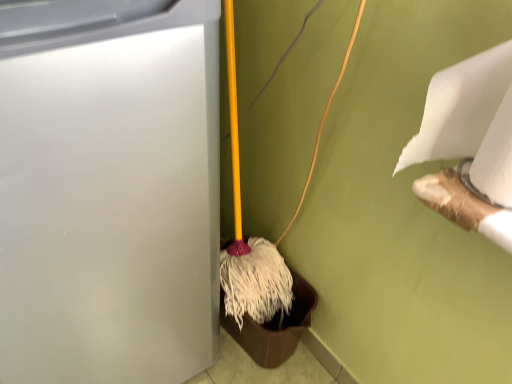
Question: Is white matte waste container at left a part of white matte toilet paper at upper right, which is the second toilet paper in left-to-right order?

Choices:
 (A) yes
 (B) no

Answer: (B)

Question: Is white matte toilet paper at upper right, which is the second toilet paper in left-to-right order, not within white matte waste container at left?

Choices:
 (A) yes
 (B) no

Answer: (A)

Question: Does white matte toilet paper at upper right, which is the 1th toilet paper in right-to-left order, appear on the left side of white matte waste container at left?

Choices:
 (A) yes
 (B) no

Answer: (B)

Question: Is white matte toilet paper at upper right, which is the 1th toilet paper in right-to-left order, oriented away from white matte waste container at left?

Choices:
 (A) yes
 (B) no

Answer: (B)

Question: Is white matte toilet paper at upper right, which is the 1th toilet paper in right-to-left order, shorter than white matte waste container at left?

Choices:
 (A) no
 (B) yes

Answer: (B)

Question: In terms of height, does white matte toilet paper at upper right, positioned as the 1th toilet paper in left-to-right order, look taller or shorter compared to white matte waste container at left?

Choices:
 (A) short
 (B) tall

Answer: (A)

Question: In the image, is white matte toilet paper at upper right, placed as the 2th toilet paper when sorted from right to left, on the left side or the right side of white matte waste container at left?

Choices:
 (A) left
 (B) right

Answer: (B)

Question: In terms of width, does white matte toilet paper at upper right, placed as the 2th toilet paper when sorted from right to left, look wider or thinner when compared to white matte waste container at left?

Choices:
 (A) wide
 (B) thin

Answer: (B)

Question: Considering their positions, is white matte toilet paper at upper right, placed as the 2th toilet paper when sorted from right to left, located in front of or behind white matte waste container at left?

Choices:
 (A) behind
 (B) front

Answer: (A)

Question: From a real-world perspective, is white matte waste container at left above or below white matte toilet paper at upper right, placed as the 2th toilet paper when sorted from right to left?

Choices:
 (A) above
 (B) below

Answer: (B)

Question: In terms of width, does white matte waste container at left look wider or thinner when compared to white matte toilet paper at upper right, positioned as the 1th toilet paper in left-to-right order?

Choices:
 (A) thin
 (B) wide

Answer: (B)

Question: Does point (104, 102) appear closer or farther from the camera than point (458, 127)?

Choices:
 (A) farther
 (B) closer

Answer: (B)

Question: Looking at the image, does white matte waste container at left seem bigger or smaller compared to white matte toilet paper at upper right, placed as the 2th toilet paper when sorted from right to left?

Choices:
 (A) small
 (B) big

Answer: (B)

Question: From a real-world perspective, is white matte toilet paper at upper right, placed as the 2th toilet paper when sorted from right to left, physically located above or below white matte toilet paper at upper right, which is the 1th toilet paper in right-to-left order?

Choices:
 (A) above
 (B) below

Answer: (B)

Question: Does point (432, 135) appear closer or farther from the camera than point (509, 117)?

Choices:
 (A) farther
 (B) closer

Answer: (A)